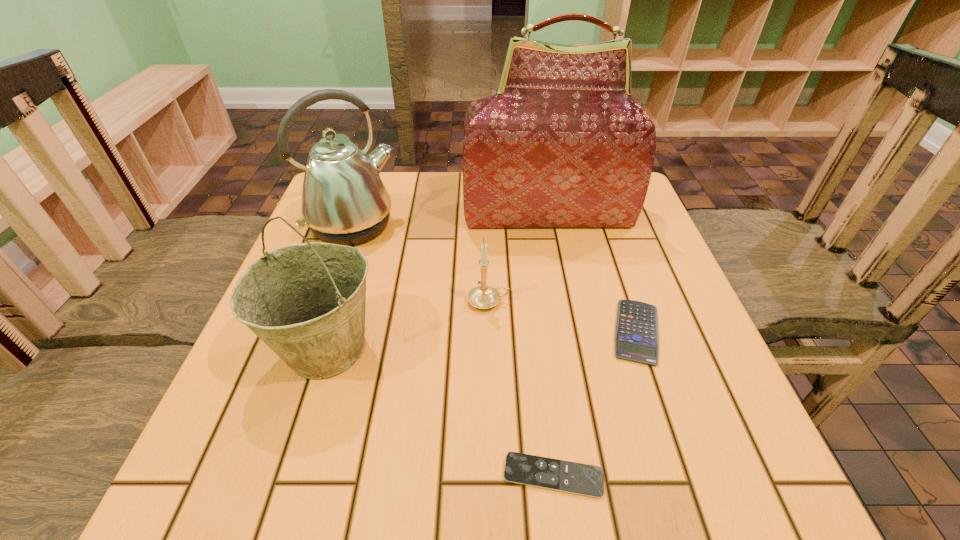
This screenshot has width=960, height=540. Identify the location of handbag. (562, 143).

The height and width of the screenshot is (540, 960). In order to click on kettle in this screenshot , I will do `click(344, 201)`.

Identify the location of wine bucket. (306, 302).

Identify the location of the fourth tallest object. (483, 296).

Image resolution: width=960 pixels, height=540 pixels. I want to click on calculator, so click(636, 336).

Image resolution: width=960 pixels, height=540 pixels. I want to click on the nearest object, so click(576, 478).

I want to click on free spot located on the front-facing side of the tallest object, so click(554, 246).

Where is `free space located 0.070m on the back of the kettle`? Image resolution: width=960 pixels, height=540 pixels. free space located 0.070m on the back of the kettle is located at coordinates (367, 187).

I want to click on vacant space situated 0.260m on the right of the wine bucket, so click(525, 348).

The image size is (960, 540). In order to click on free region located 0.110m on the handle side of the fourth tallest object in this screenshot , I will do `click(564, 301)`.